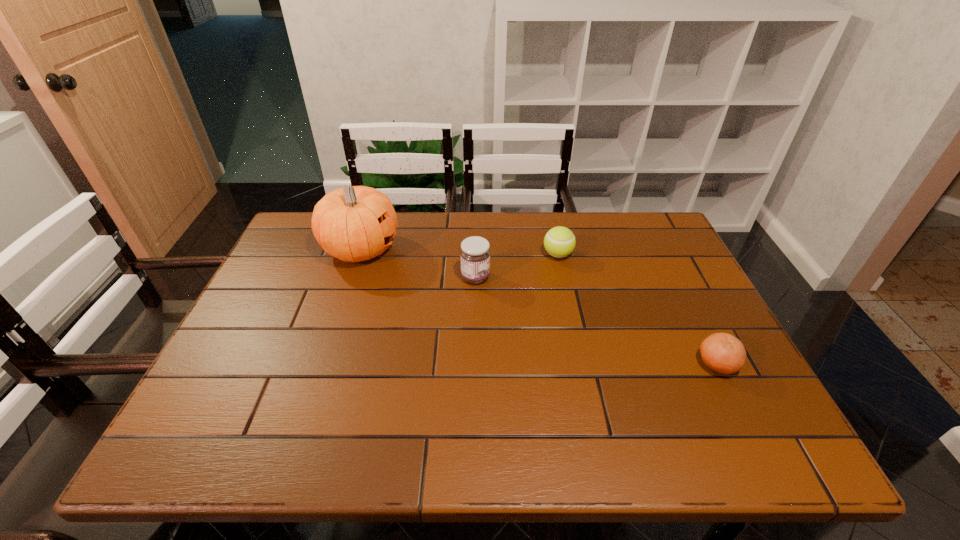
Where is `free space located 0.290m on the right of the tennis ball`? The width and height of the screenshot is (960, 540). free space located 0.290m on the right of the tennis ball is located at coordinates (673, 254).

The width and height of the screenshot is (960, 540). What are the coordinates of `vacant area situated on the back of the clementine` in the screenshot? It's located at (678, 285).

This screenshot has width=960, height=540. What are the coordinates of `pumpkin present at the far edge` in the screenshot? It's located at (354, 223).

Identify the location of tennis ball positioned at the far edge. This screenshot has height=540, width=960. (559, 242).

At what (x,y) coordinates should I click in order to perform the action: click on object at the left edge. Please return your answer as a coordinate pair (x, y). Looking at the image, I should click on (354, 223).

The image size is (960, 540). Identify the location of object that is at the right edge. (723, 353).

Locate an element on the screen. The height and width of the screenshot is (540, 960). object that is at the far left corner is located at coordinates coord(354,223).

This screenshot has height=540, width=960. Find the location of `free region at the near edge of the desktop`. free region at the near edge of the desktop is located at coordinates (401, 416).

In order to click on vacant space at the left edge in this screenshot , I will do `click(272, 266)`.

In the image, there is a desktop. What are the coordinates of `free space at the right edge` in the screenshot? It's located at (670, 275).